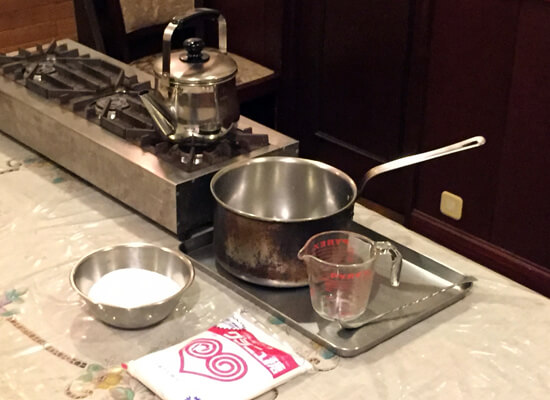
Identify the location of stove top. (99, 89).